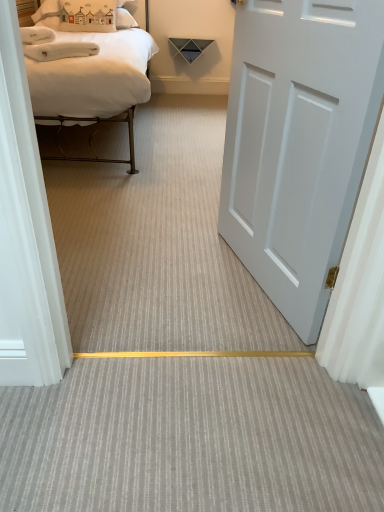
The image size is (384, 512). Identify the location of free location above gray textured carpet at center (from a real-world perspective). (191, 420).